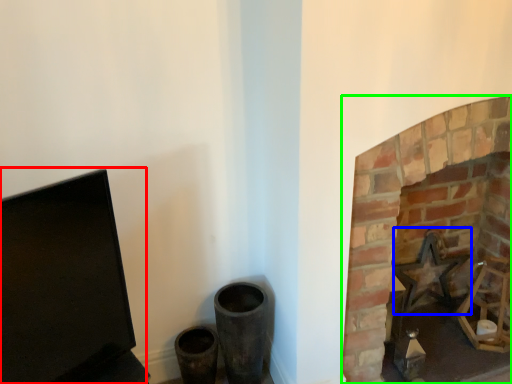
Question: Estimate the real-world distances between objects in this image. Which object is closer to computer monitor (highlighted by a red box), swivel chair (highlighted by a blue box) or fireplace (highlighted by a green box)?

Choices:
 (A) swivel chair
 (B) fireplace

Answer: (B)